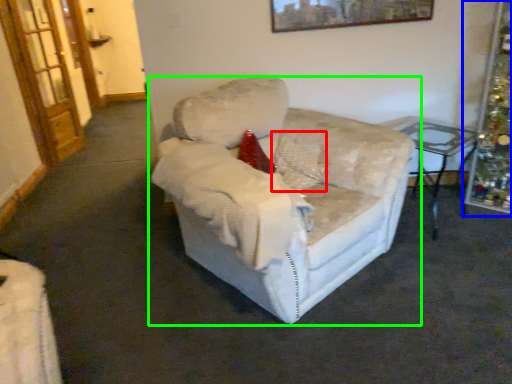
Question: Estimate the real-world distances between objects in this image. Which object is closer to pillow (highlighted by a red box), christmas decoration (highlighted by a blue box) or chair (highlighted by a green box)?

Choices:
 (A) christmas decoration
 (B) chair

Answer: (B)